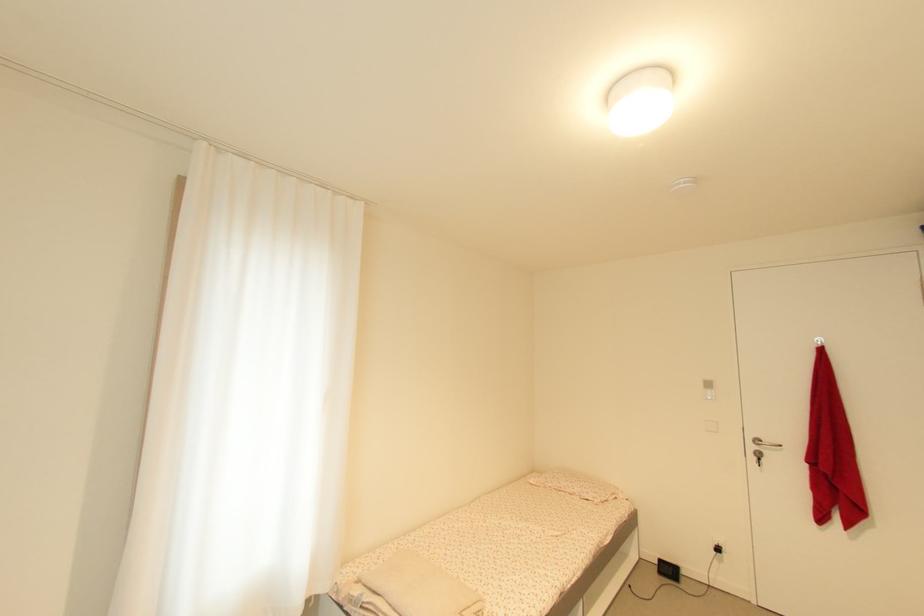
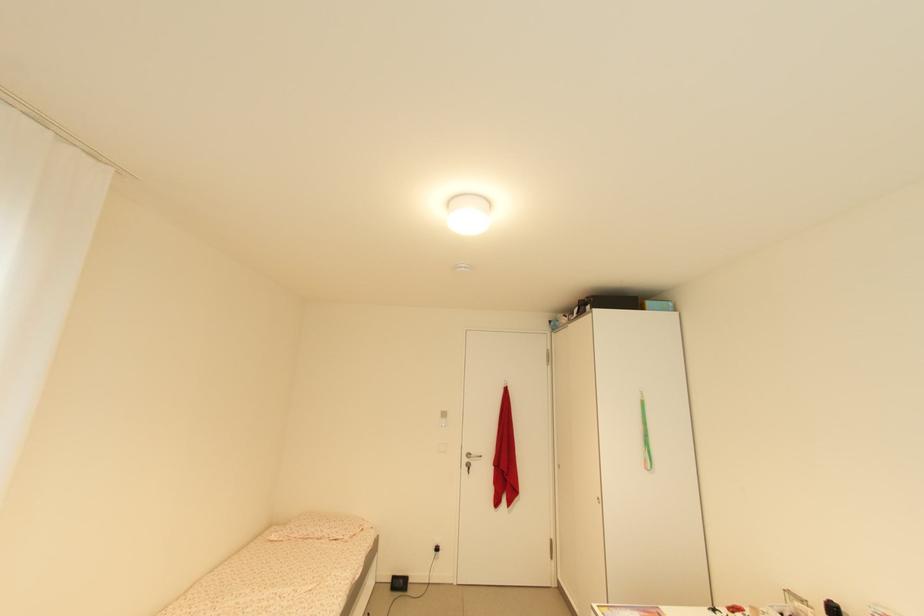
Where in the second image is the point corresponding to (758,448) from the first image?

(470, 461)